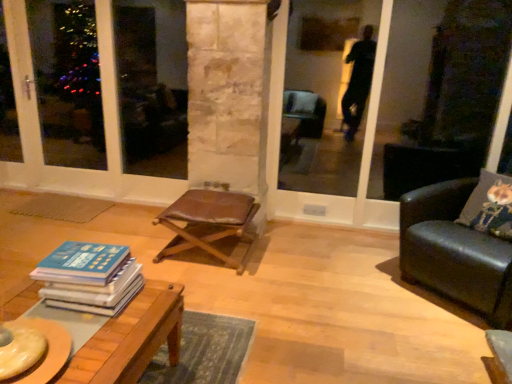
The width and height of the screenshot is (512, 384). I want to click on free point above wooden table at lower left (from a real-world perspective), so click(x=78, y=327).